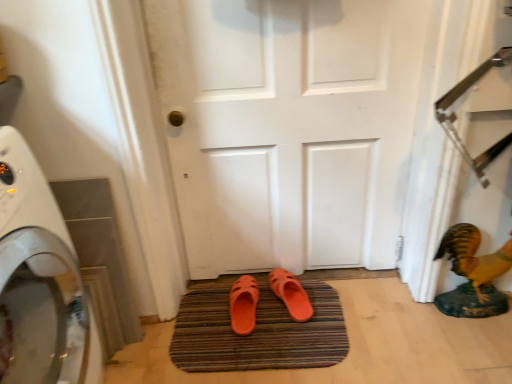
Question: Which direction should I rotate to look at orange rubber slipper at center, the first footwear from the right, — up or down?

Choices:
 (A) down
 (B) up

Answer: (A)

Question: Could white matte door at center be considered to be inside orange rubber slipper at center, the first footwear from the right?

Choices:
 (A) yes
 (B) no

Answer: (B)

Question: Considering the relative sizes of orange rubber slipper at center, the first footwear from the right, and white matte door at center in the image provided, is orange rubber slipper at center, the first footwear from the right, wider than white matte door at center?

Choices:
 (A) no
 (B) yes

Answer: (B)

Question: Can you confirm if orange rubber slipper at center, the first footwear from the right, is shorter than white matte door at center?

Choices:
 (A) no
 (B) yes

Answer: (B)

Question: Considering the relative sizes of orange rubber slipper at center, the 2th footwear positioned from the left, and white matte door at center in the image provided, is orange rubber slipper at center, the 2th footwear positioned from the left, taller than white matte door at center?

Choices:
 (A) no
 (B) yes

Answer: (A)

Question: Is orange rubber slipper at center, the first footwear from the right, to the left of white matte door at center from the viewer's perspective?

Choices:
 (A) yes
 (B) no

Answer: (B)

Question: Considering the relative sizes of orange rubber slipper at center, the first footwear from the right, and white matte door at center in the image provided, is orange rubber slipper at center, the first footwear from the right, bigger than white matte door at center?

Choices:
 (A) no
 (B) yes

Answer: (A)

Question: Is orange rubber slipper at center, the first footwear from the right, not inside orange rubber bath mat at center?

Choices:
 (A) no
 (B) yes

Answer: (B)

Question: Is orange rubber slipper at center, the first footwear from the right, further to camera compared to orange rubber bath mat at center?

Choices:
 (A) no
 (B) yes

Answer: (B)

Question: Considering the relative sizes of orange rubber slipper at center, the 2th footwear positioned from the left, and orange rubber bath mat at center in the image provided, is orange rubber slipper at center, the 2th footwear positioned from the left, bigger than orange rubber bath mat at center?

Choices:
 (A) no
 (B) yes

Answer: (A)

Question: Is orange rubber slipper at center, the 2th footwear positioned from the left, looking in the opposite direction of orange rubber bath mat at center?

Choices:
 (A) no
 (B) yes

Answer: (A)

Question: From a real-world perspective, is orange rubber slipper at center, the first footwear from the right, below orange rubber bath mat at center?

Choices:
 (A) yes
 (B) no

Answer: (B)

Question: From the image's perspective, does orange rubber slipper at center, the 2th footwear positioned from the left, appear higher than orange rubber bath mat at center?

Choices:
 (A) no
 (B) yes

Answer: (B)

Question: Considering the relative sizes of orange rubber bath mat at center and white matte door at center in the image provided, is orange rubber bath mat at center bigger than white matte door at center?

Choices:
 (A) yes
 (B) no

Answer: (B)